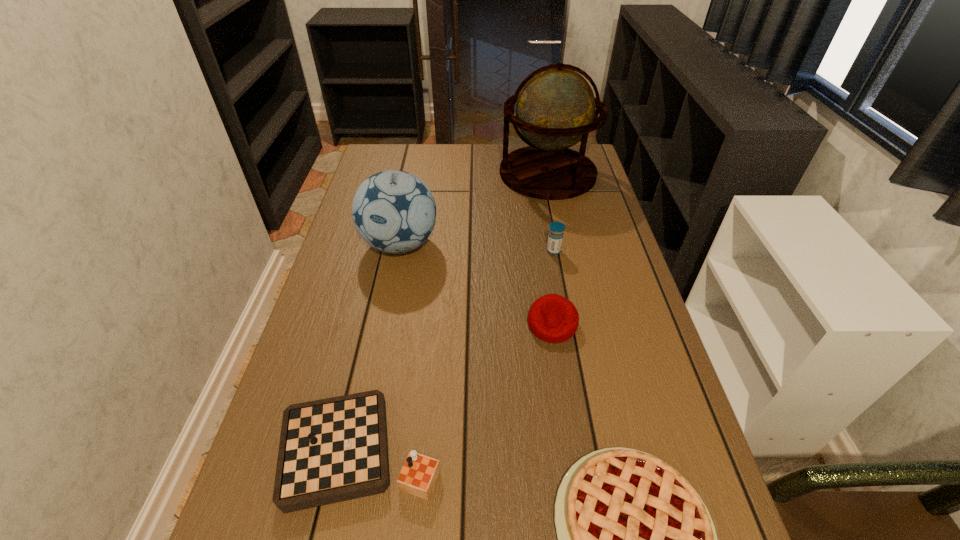
The width and height of the screenshot is (960, 540). In order to click on free location located 0.220m on the front of the third tallest object in this screenshot , I will do `click(565, 314)`.

This screenshot has height=540, width=960. What are the coordinates of `vacant space situated on the seat area of the beanbag` in the screenshot? It's located at (580, 504).

The width and height of the screenshot is (960, 540). I want to click on vacant space located on the back of the chessboard, so [x=381, y=345].

This screenshot has width=960, height=540. Identify the location of object located at the far edge. (555, 109).

At what (x,y) coordinates should I click in order to perform the action: click on soccer ball positioned at the left edge. Please return your answer as a coordinate pair (x, y). This screenshot has height=540, width=960. Looking at the image, I should click on (394, 211).

Where is `chessboard at the left edge`? Image resolution: width=960 pixels, height=540 pixels. chessboard at the left edge is located at coordinates [331, 450].

Where is `object at the right edge`? This screenshot has width=960, height=540. object at the right edge is located at coordinates (555, 109).

This screenshot has width=960, height=540. I want to click on object that is positioned at the far right corner, so click(555, 109).

In the image, there is a desktop. Identify the location of vacant space at the far edge. Image resolution: width=960 pixels, height=540 pixels. (415, 173).

This screenshot has width=960, height=540. I want to click on vacant space at the left edge of the desktop, so click(323, 340).